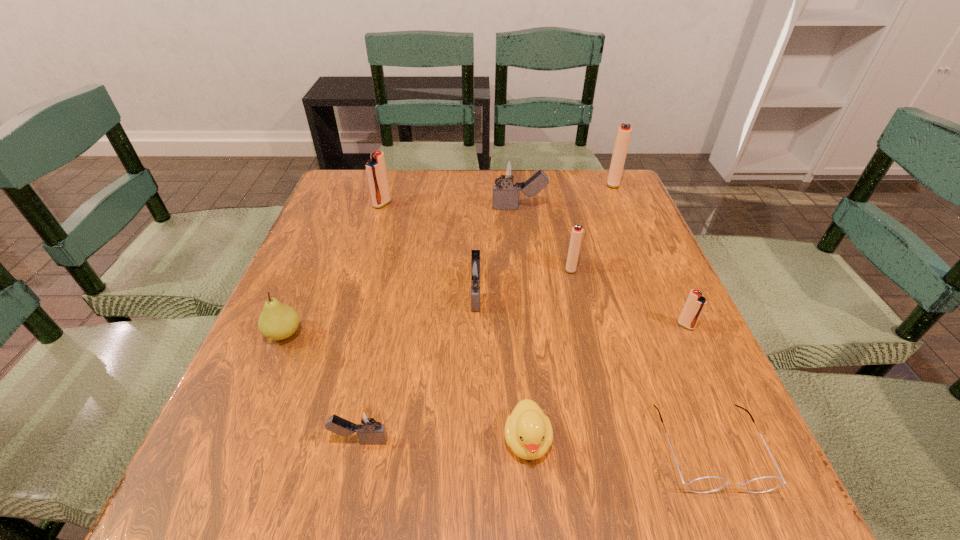
This screenshot has height=540, width=960. I want to click on vacant area that lies between the seventh object from left to right and the fourth igniter from right to left, so click(545, 238).

I want to click on vacant region between the pear and the nearest gray igniter, so click(x=323, y=387).

You are a GUI agent. You are given a task and a screenshot of the screen. Output one action in this format:
    pyautogui.click(x=<x>, y=<y>)
    Task: Click on the vacant space that's between the biggest gray igniter and the green pear
    Image resolution: width=960 pixels, height=540 pixels.
    Given the screenshot: What is the action you would take?
    pyautogui.click(x=402, y=271)

This screenshot has height=540, width=960. What are the coordinates of `object that stands as the third closest to the smallest red igniter` in the screenshot? It's located at (528, 431).

Identify which object is located as the second nearest to the leftmost igniter. Please provide its 2D coordinates. Your answer should be formatted as a tuple, i.e. [(x, y)], where the tuple contains the x and y coordinates of a point satisfying the conditions above.

[(474, 270)]

Choose which igniter is the fourth nearest neighbor to the leftmost gray igniter. Please provide its 2D coordinates. Your answer should be formatted as a tuple, i.e. [(x, y)], where the tuple contains the x and y coordinates of a point satisfying the conditions above.

[(506, 171)]

Locate an element on the screen. This screenshot has height=540, width=960. the third closest igniter to the leftmost object is located at coordinates (376, 169).

Identify which red igniter is the closest to the shortest object. Please provide its 2D coordinates. Your answer should be formatted as a tuple, i.e. [(x, y)], where the tuple contains the x and y coordinates of a point satisfying the conditions above.

[(695, 304)]

Locate an element on the screen. red igniter that is the closest to the fourth farthest object is located at coordinates (695, 304).

The height and width of the screenshot is (540, 960). I want to click on the second closest gray igniter to the leftmost gray igniter, so click(506, 171).